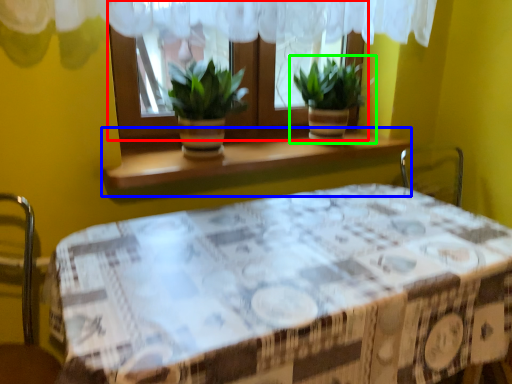
Question: Estimate the real-world distances between objects in this image. Which object is closer to window (highlighted by a red box), window sill (highlighted by a blue box) or houseplant (highlighted by a green box)?

Choices:
 (A) window sill
 (B) houseplant

Answer: (B)